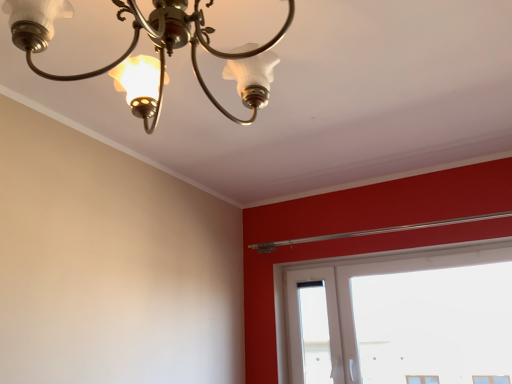
Question: In terms of width, does white plastic window at lower right look wider or thinner when compared to matte glass chandelier at upper left?

Choices:
 (A) thin
 (B) wide

Answer: (A)

Question: Would you say white plastic window at lower right is inside or outside matte glass chandelier at upper left?

Choices:
 (A) outside
 (B) inside

Answer: (A)

Question: Based on their positions, is white plastic window at lower right located to the left or right of matte glass chandelier at upper left?

Choices:
 (A) left
 (B) right

Answer: (B)

Question: Relative to white plastic window at lower right, is matte glass chandelier at upper left in front or behind?

Choices:
 (A) front
 (B) behind

Answer: (A)

Question: Considering the relative positions of matte glass chandelier at upper left and white plastic window at lower right in the image provided, is matte glass chandelier at upper left to the left or to the right of white plastic window at lower right?

Choices:
 (A) right
 (B) left

Answer: (B)

Question: Choose the correct answer: Is matte glass chandelier at upper left inside white plastic window at lower right or outside it?

Choices:
 (A) inside
 (B) outside

Answer: (B)

Question: Considering the positions of matte glass chandelier at upper left and white plastic window at lower right in the image, is matte glass chandelier at upper left taller or shorter than white plastic window at lower right?

Choices:
 (A) tall
 (B) short

Answer: (B)